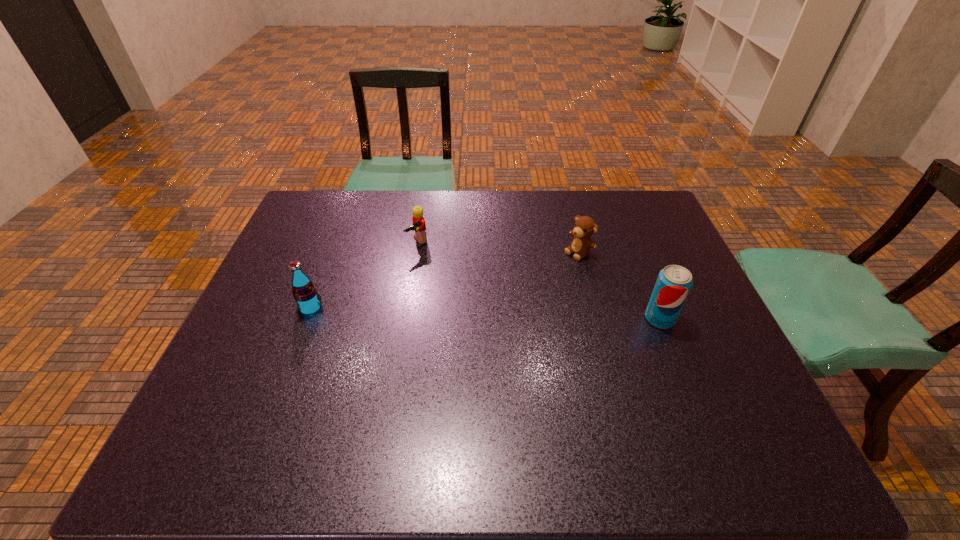
This screenshot has height=540, width=960. In the image, there is a desktop. In order to click on vacant space at the near left corner in this screenshot , I will do `click(279, 394)`.

Find the location of `vacant area at the near right corner`. vacant area at the near right corner is located at coordinates (709, 413).

Find the location of `free space between the third object from left to right and the right soda can`. free space between the third object from left to right and the right soda can is located at coordinates (619, 285).

I want to click on free space between the teddy bear and the third object from right to left, so click(x=498, y=247).

The image size is (960, 540). I want to click on vacant region between the second object from left to right and the leftmost object, so click(x=364, y=275).

Identify the location of vacant region between the right soda can and the Lego. The image size is (960, 540). [539, 280].

This screenshot has width=960, height=540. Identify the location of empty space that is in between the left soda can and the Lego. (364, 275).

The height and width of the screenshot is (540, 960). Identify the location of vacant space that's between the rightmost object and the teddy bear. (619, 285).

Find the location of a particular element. The image size is (960, 540). unoccupied area between the right soda can and the Lego is located at coordinates (539, 280).

This screenshot has width=960, height=540. I want to click on empty location between the left soda can and the Lego, so click(x=364, y=275).